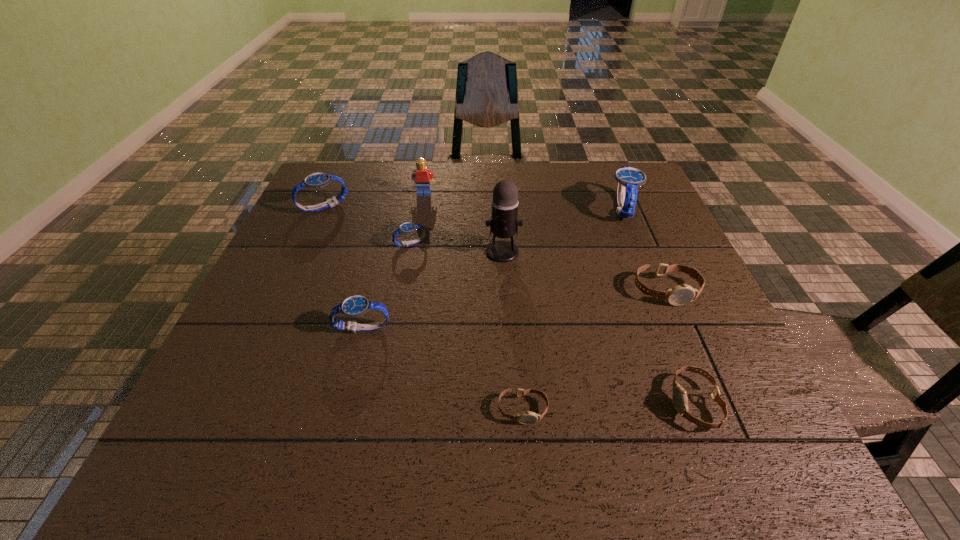
Identify the location of the sixth farthest object. The width and height of the screenshot is (960, 540). (679, 295).

Find the location of a particular element. the fifth nearest watch is located at coordinates (407, 227).

Locate an element on the screen. This screenshot has width=960, height=540. the second nearest blue watch is located at coordinates (407, 227).

Where is `the second smallest beige watch`? The height and width of the screenshot is (540, 960). the second smallest beige watch is located at coordinates (680, 401).

You are a GUI agent. You are given a task and a screenshot of the screen. Output one action in this format:
    pyautogui.click(x=<x>, y=<y>)
    Task: Click on the shortest watch
    
    Given the screenshot: What is the action you would take?
    pyautogui.click(x=528, y=417)

What are the coordinates of `the fourth watch from right to left` in the screenshot? It's located at (528, 417).

Where is `free spot located on the back of the microphone`? The height and width of the screenshot is (540, 960). free spot located on the back of the microphone is located at coordinates (498, 168).

Where is `free space located 0.400m on the front-facing side of the Lego`? free space located 0.400m on the front-facing side of the Lego is located at coordinates (408, 290).

Identify the location of vacant space situated 0.250m on the left of the tallest watch. This screenshot has width=960, height=540. (519, 208).

Where is `free point located on the right of the leftmost blue watch`? The height and width of the screenshot is (540, 960). free point located on the right of the leftmost blue watch is located at coordinates (434, 207).